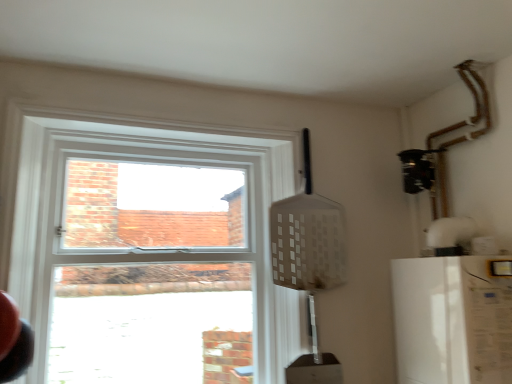
Question: Is white matte refrigerator at right at the left side of clear glass window at upper left?

Choices:
 (A) yes
 (B) no

Answer: (B)

Question: From the image's perspective, would you say white matte refrigerator at right is shown under clear glass window at upper left?

Choices:
 (A) yes
 (B) no

Answer: (A)

Question: From a real-world perspective, is white matte refrigerator at right located beneath clear glass window at upper left?

Choices:
 (A) no
 (B) yes

Answer: (B)

Question: Is white matte refrigerator at right facing away from clear glass window at upper left?

Choices:
 (A) no
 (B) yes

Answer: (A)

Question: Is white matte refrigerator at right positioned beyond the bounds of clear glass window at upper left?

Choices:
 (A) no
 (B) yes

Answer: (B)

Question: Is white matte refrigerator at right shorter than clear glass window at upper left?

Choices:
 (A) yes
 (B) no

Answer: (A)

Question: Does clear glass window at upper left appear on the right side of white matte refrigerator at right?

Choices:
 (A) no
 (B) yes

Answer: (A)

Question: Does clear glass window at upper left have a greater height compared to white matte refrigerator at right?

Choices:
 (A) no
 (B) yes

Answer: (B)

Question: Is clear glass window at upper left behind white matte refrigerator at right?

Choices:
 (A) yes
 (B) no

Answer: (A)

Question: Is clear glass window at upper left facing towards white matte refrigerator at right?

Choices:
 (A) no
 (B) yes

Answer: (A)

Question: From the image's perspective, is clear glass window at upper left on top of white matte refrigerator at right?

Choices:
 (A) yes
 (B) no

Answer: (A)

Question: Is clear glass window at upper left in front of white matte refrigerator at right?

Choices:
 (A) no
 (B) yes

Answer: (A)

Question: Looking at their shapes, would you say clear glass window at upper left is wider or thinner than white matte refrigerator at right?

Choices:
 (A) thin
 (B) wide

Answer: (A)